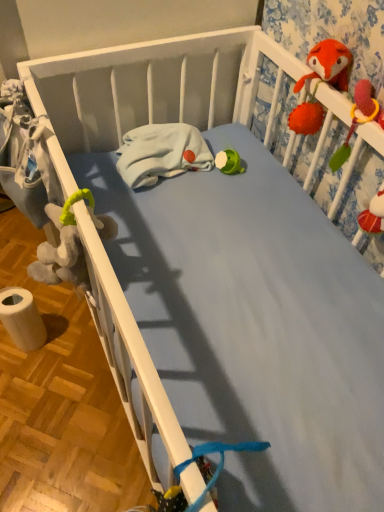
Find the location of a particular element. This screenshot has height=512, width=384. free point to the right of white paper towel at lower left is located at coordinates (73, 351).